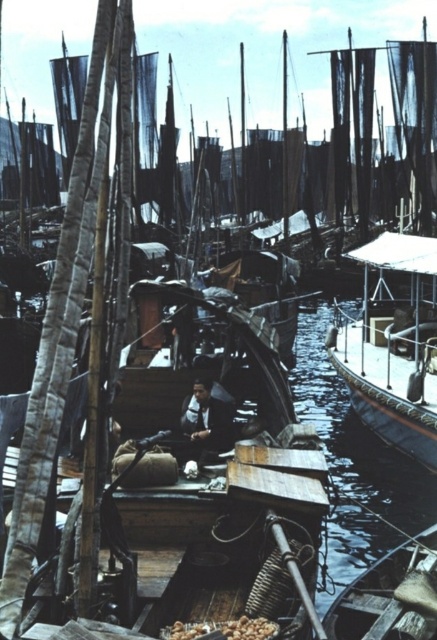
You are a sailor who needs to board the wooden boat at right and the wooden boat at lower right. Which boat will require you to climb higher to reach its deck?

The wooden boat at right is taller than the wooden boat at lower right, so you will need to climb higher to reach its deck.

From the picture: You are standing on the dock and want to board the wooden boat at lower right. Given that the average person can comfortably jump 10 feet, can you reach the boat in one jump?

The wooden boat at lower right is 31.44 feet away from you. Since the average person can only jump 10 feet, you cannot reach the boat in one jump.